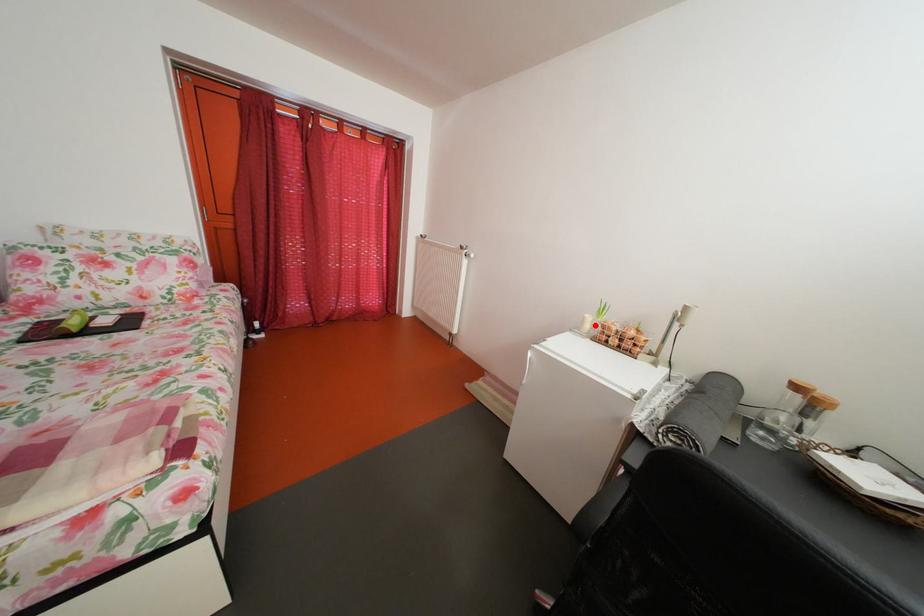
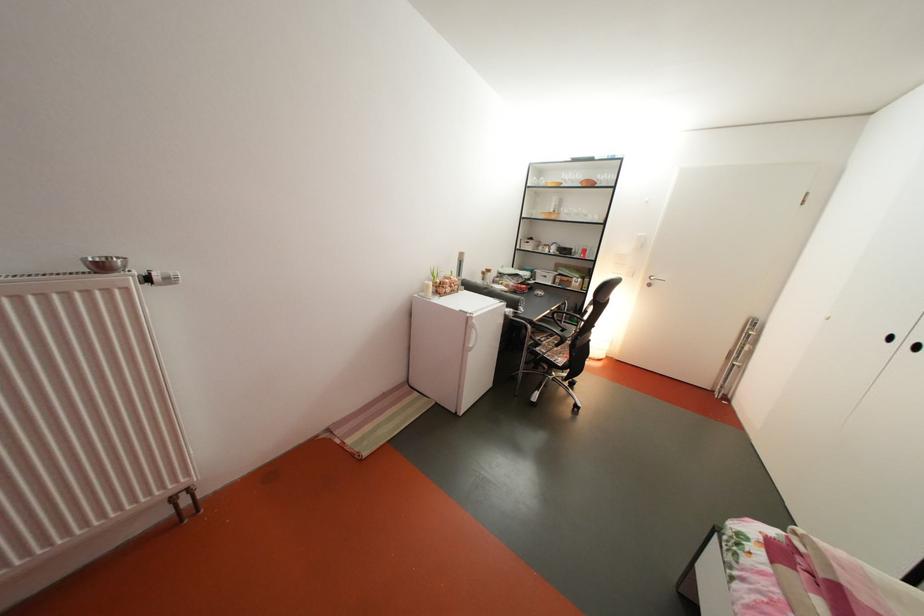
Find the pixel in the second image that matches the highlighted location in the first image.

(439, 293)